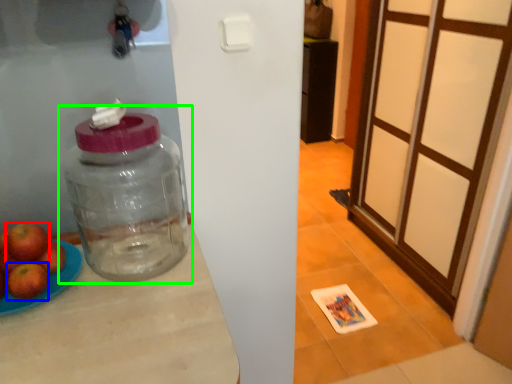
Question: Which object is the farthest from apple (highlighted by a red box)? Choose among these: apple (highlighted by a blue box) or bottle (highlighted by a green box).

Choices:
 (A) apple
 (B) bottle

Answer: (B)